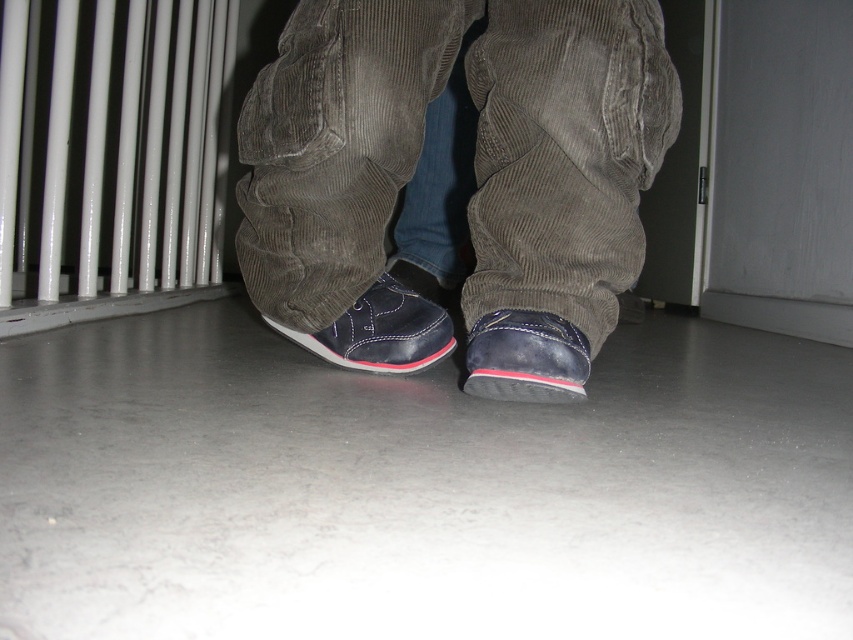
Can you confirm if matte corduroy pants at center is positioned to the left of matte leather shoe at lower center?

Indeed, matte corduroy pants at center is positioned on the left side of matte leather shoe at lower center.

At what (x,y) coordinates should I click in order to perform the action: click on matte corduroy pants at center. Please return your answer as a coordinate pair (x, y). This screenshot has height=640, width=853. Looking at the image, I should click on (474, 177).

In order to click on matte corduroy pants at center in this screenshot , I will do `click(474, 177)`.

Where is `matte corduroy pants at center`? This screenshot has width=853, height=640. matte corduroy pants at center is located at coordinates (474, 177).

Does matte corduroy pants at center have a smaller size compared to white glossy radiator at left?

Indeed, matte corduroy pants at center has a smaller size compared to white glossy radiator at left.

Does point (479, 152) come closer to viewer compared to point (53, 298)?

Yes, point (479, 152) is in front of point (53, 298).

What are the coordinates of `matte corduroy pants at center` in the screenshot? It's located at (474, 177).

Is point (503, 344) closer to camera compared to point (341, 344)?

Yes, point (503, 344) is closer to viewer.

Looking at this image, is matte leather shoe at lower center to the right of matte leather shoe at center from the viewer's perspective?

Indeed, matte leather shoe at lower center is positioned on the right side of matte leather shoe at center.

Is point (569, 401) in front of point (387, 296)?

Yes, it is in front of point (387, 296).

Identify the location of matte leather shoe at lower center. This screenshot has height=640, width=853. (526, 356).